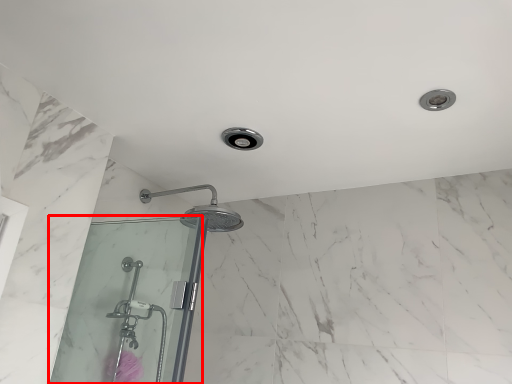
Question: In this image, where is screen door (annotated by the red box) located relative to flower?

Choices:
 (A) right
 (B) left

Answer: (A)